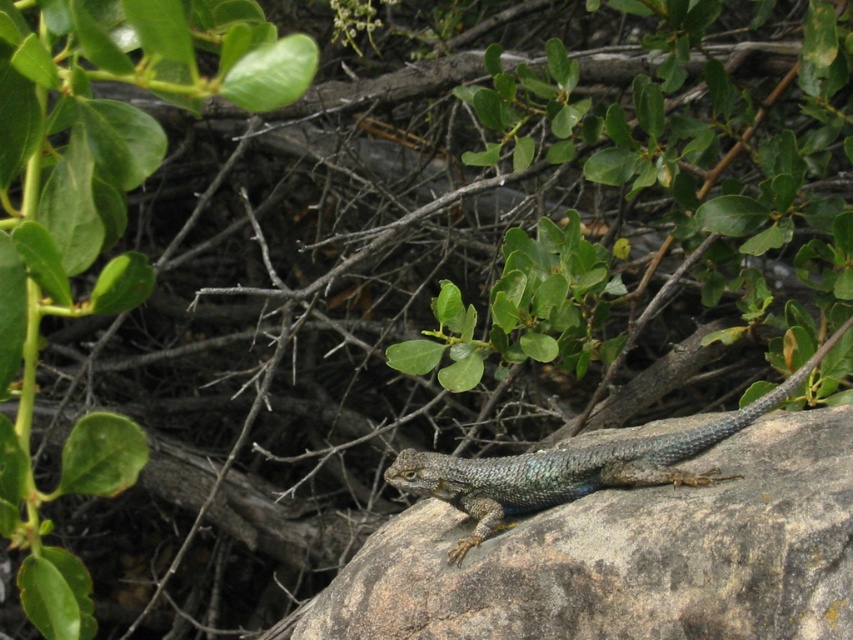
Question: Which is nearer to the green leafy plant at upper left?

Choices:
 (A) shiny blue lizard at center
 (B) rough textured rock at center

Answer: (B)

Question: Is the position of green leafy plant at upper left more distant than that of shiny blue lizard at center?

Choices:
 (A) no
 (B) yes

Answer: (A)

Question: Does rough textured rock at center come behind shiny blue lizard at center?

Choices:
 (A) no
 (B) yes

Answer: (A)

Question: Among these points, which one is nearest to the camera?

Choices:
 (A) (97, 65)
 (B) (724, 589)

Answer: (A)

Question: Which point is farther from the camera taking this photo?

Choices:
 (A) pos(480,476)
 (B) pos(688,593)
 (C) pos(144,60)

Answer: (A)

Question: Does green leafy plant at upper left have a greater width compared to shiny blue lizard at center?

Choices:
 (A) no
 (B) yes

Answer: (A)